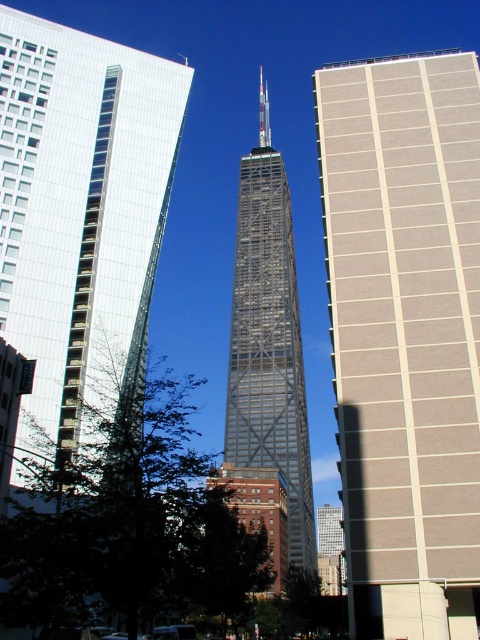
Question: Based on their relative distances, which object is farther from the beige textured building at right?

Choices:
 (A) glassy steel tower at center
 (B) green leafy tree at lower left
 (C) glassy reflective skyscraper at center

Answer: (A)

Question: Does green leafy tree at lower left appear under glassy steel tower at center?

Choices:
 (A) no
 (B) yes

Answer: (B)

Question: Among these points, which one is nearest to the camera?

Choices:
 (A) (468, 618)
 (B) (57, 620)
 (C) (132, 88)
 (D) (249, 413)

Answer: (B)

Question: Which is nearer to the beige textured building at right?

Choices:
 (A) glassy steel tower at center
 (B) green leafy tree at lower left

Answer: (B)

Question: Is glassy reflective skyscraper at center thinner than green leafy tree at lower left?

Choices:
 (A) yes
 (B) no

Answer: (A)

Question: Is beige textured building at right in front of glassy steel tower at center?

Choices:
 (A) yes
 (B) no

Answer: (A)